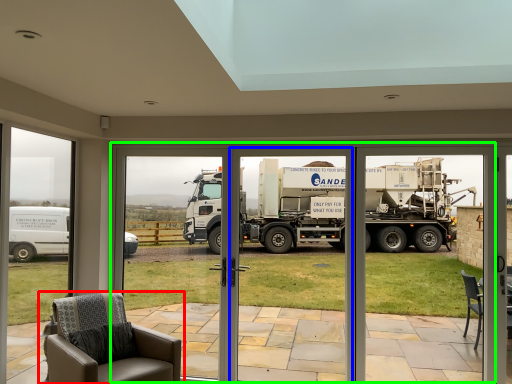
Question: Which object is the farthest from chair (highlighted by a red box)? Choose among these: garage door (highlighted by a blue box) or garage door (highlighted by a green box).

Choices:
 (A) garage door
 (B) garage door

Answer: (A)